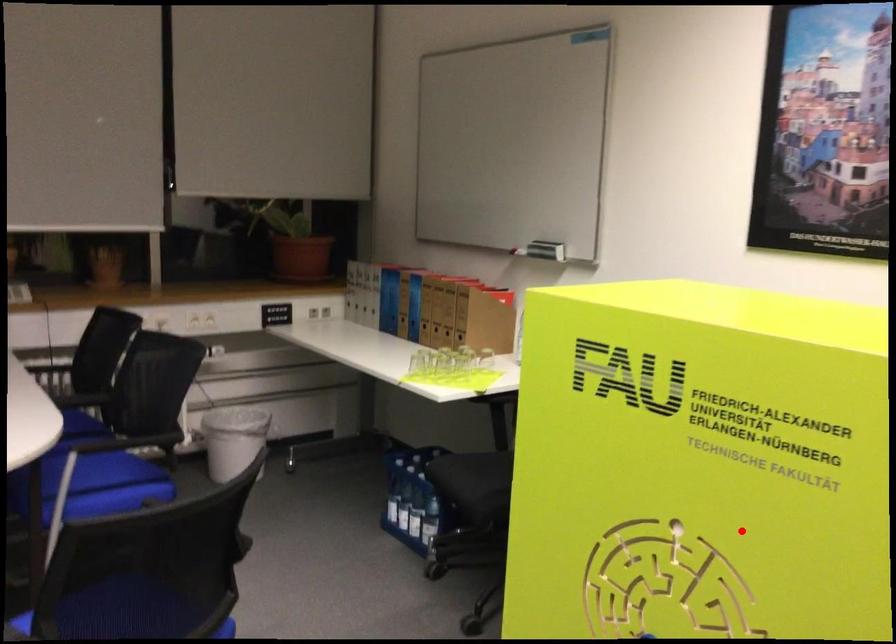
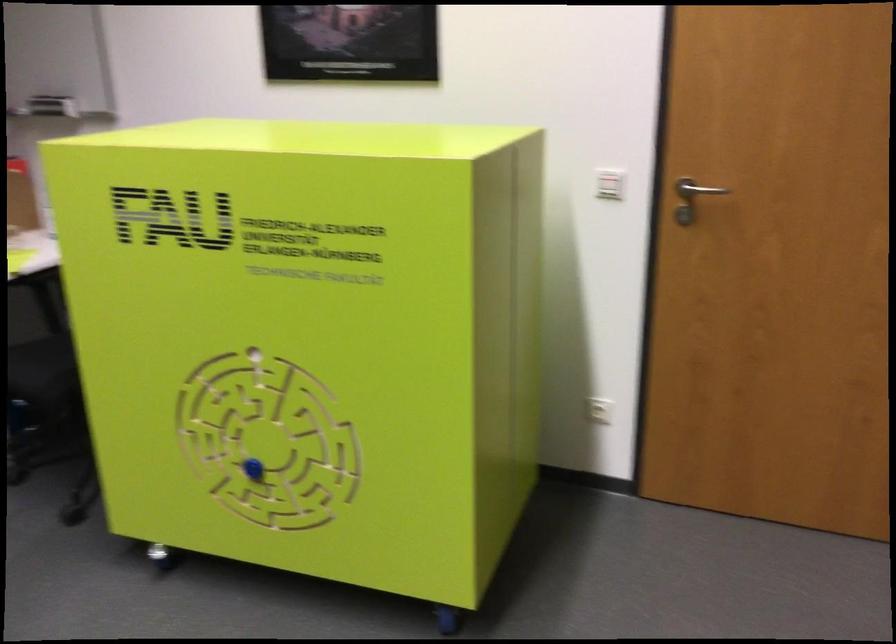
Where in the second image is the point corresponding to the highlighted location from the first image?

(309, 341)